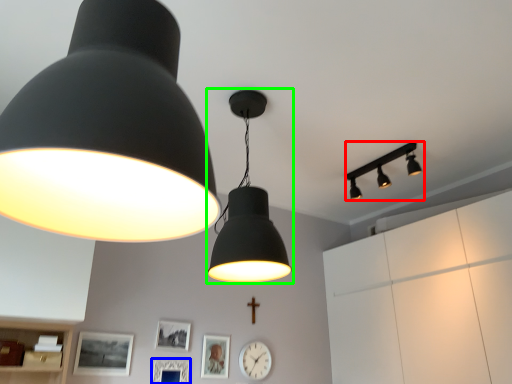
Question: Which object is positioned closest to lamp (highlighted by a red box)? Select from picture frame (highlighted by a blue box) and lamp (highlighted by a green box).

Choices:
 (A) picture frame
 (B) lamp

Answer: (B)